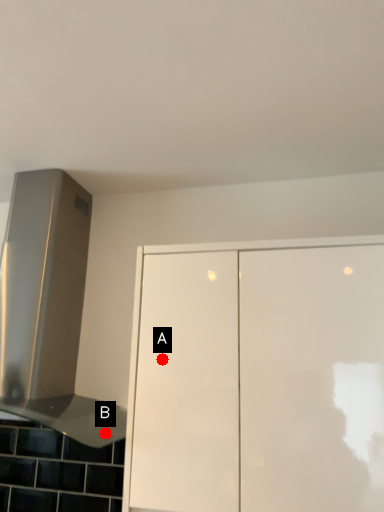
Question: Two points are circled on the image, labeled by A and B beside each circle. Which point appears closest to the camera in this image?

Choices:
 (A) A is closer
 (B) B is closer

Answer: (A)